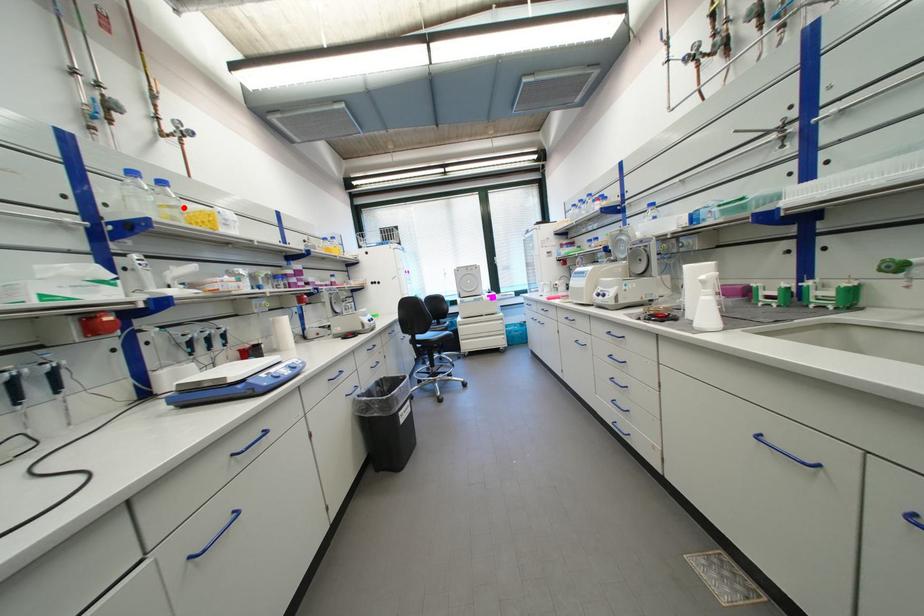
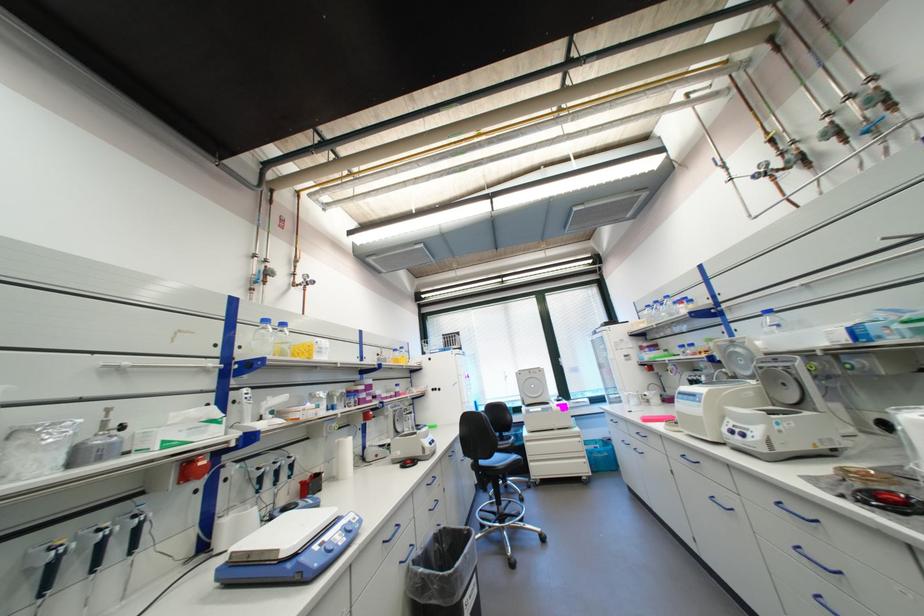
Where in the second image is the point corresponding to the highlighted location from the first image?

(295, 344)